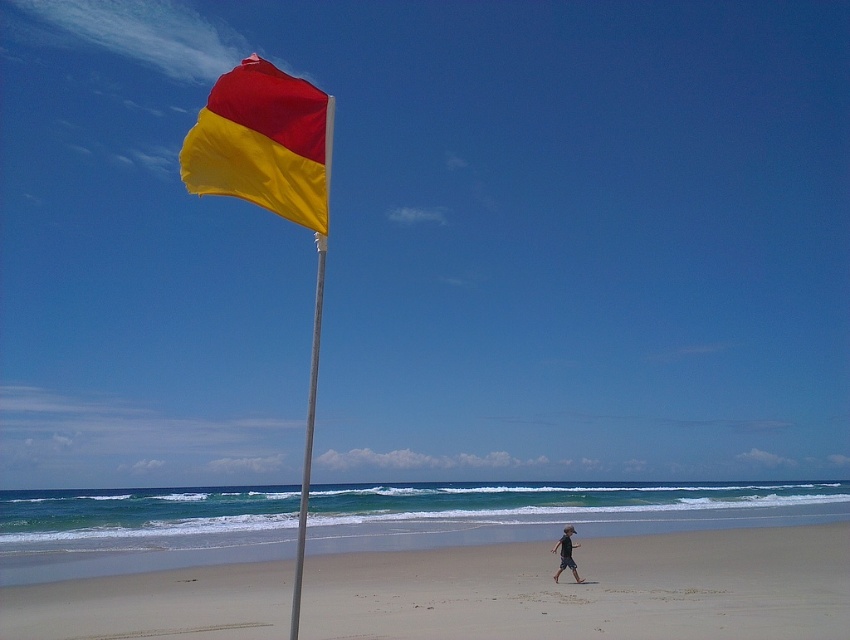
Question: Which of these objects is positioned farthest from the tan skin person at center?

Choices:
 (A) matte fabric flag at upper left
 (B) sandy beach at center
 (C) silver metallic flag pole at left

Answer: (C)

Question: Based on their relative distances, which object is farther from the matte fabric flag at upper left?

Choices:
 (A) sandy beach at center
 (B) tan skin person at center
 (C) silver metallic flag pole at left

Answer: (C)

Question: Is matte fabric flag at upper left below tan skin person at center?

Choices:
 (A) no
 (B) yes

Answer: (A)

Question: Is sandy beach at center below tan skin person at center?

Choices:
 (A) no
 (B) yes

Answer: (B)

Question: Among these objects, which one is nearest to the camera?

Choices:
 (A) matte fabric flag at upper left
 (B) sandy beach at center

Answer: (A)

Question: Does matte fabric flag at upper left appear on the right side of tan skin person at center?

Choices:
 (A) no
 (B) yes

Answer: (A)